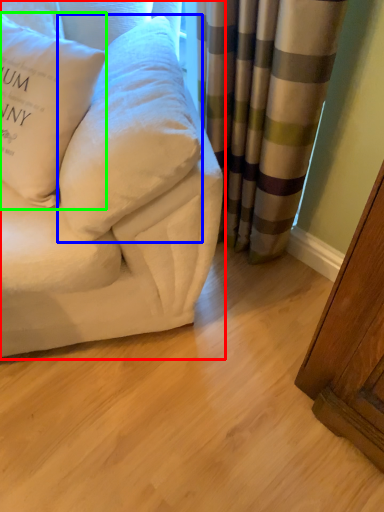
Question: Which is nearer to the studio couch (highlighted by a red box)? pillow (highlighted by a blue box) or pillow (highlighted by a green box).

Choices:
 (A) pillow
 (B) pillow

Answer: (A)